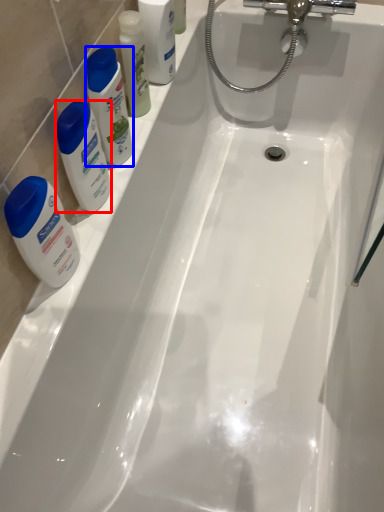
Question: Which object appears closest to the camera in this image, cleaning product (highlighted by a red box) or cleaning product (highlighted by a blue box)?

Choices:
 (A) cleaning product
 (B) cleaning product

Answer: (A)